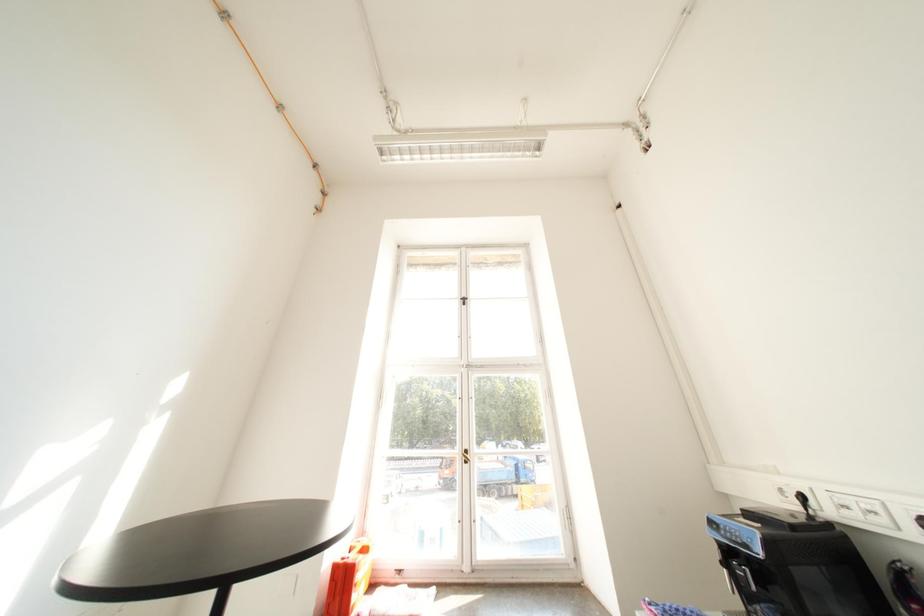
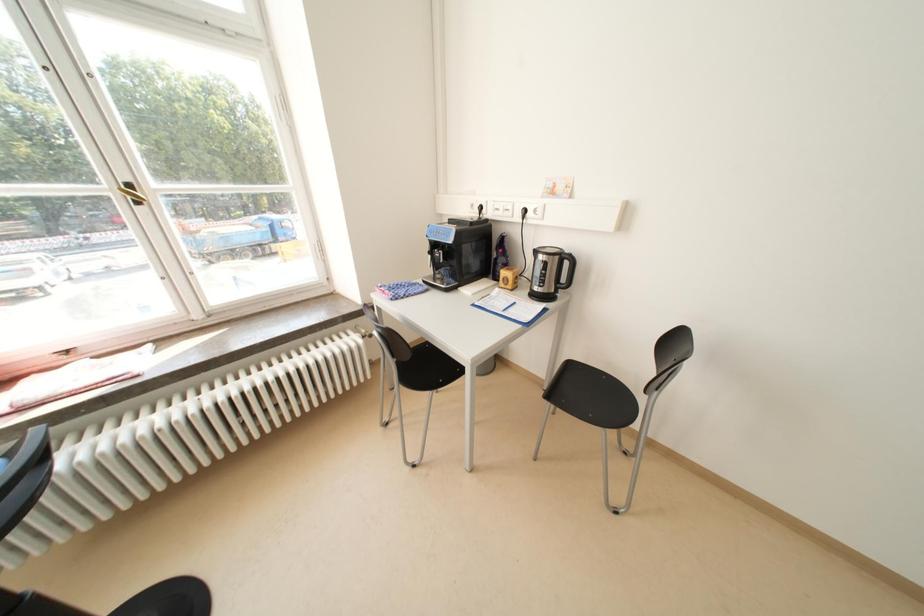
The first image is from the beginning of the video and the second image is from the end. How did the camera likely rotate when shooting the video?

The camera's rotation is toward right-down.